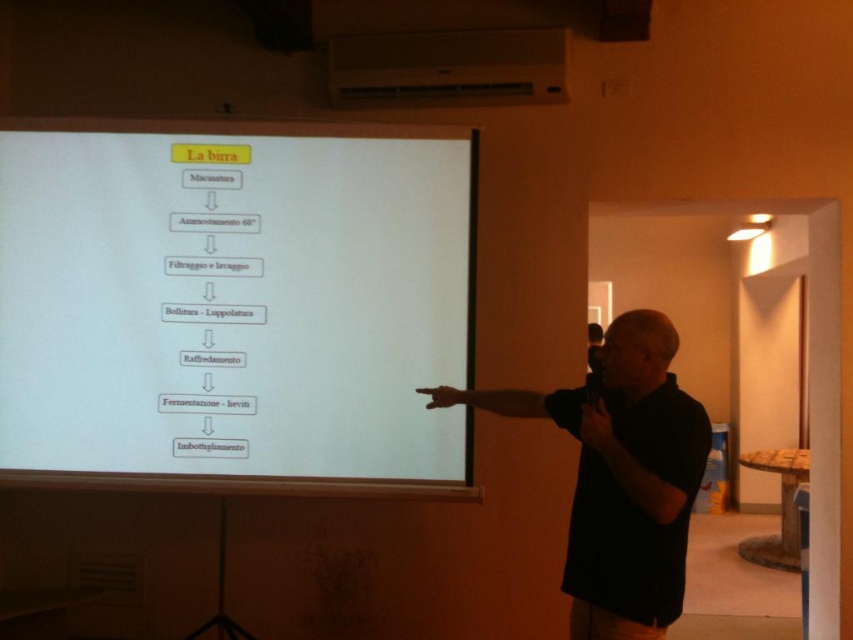
From the picture: You are an attendee at the presentation and need to locate the presenter. Which object is closer to the right side of the frame between the black matte shirt at center and the white plastic projector at upper center?

The black matte shirt at center is to the right of the white plastic projector at upper center, so the black matte shirt at center is closer to the right side of the frame.

You are an attendee at the presentation and want to take a photo of the white paper at center and the black matte shirt at center. Which object should you focus on first to ensure both are in the frame?

You should focus on the black matte shirt at center first because the white paper at center is positioned over it, meaning the shirt is underneath and the paper is on top. By focusing on the shirt, you can ensure both are within the frame since the paper is already above it.

What is located at the coordinates point (235, 305)?

At point (235, 305) lies white paper at center.